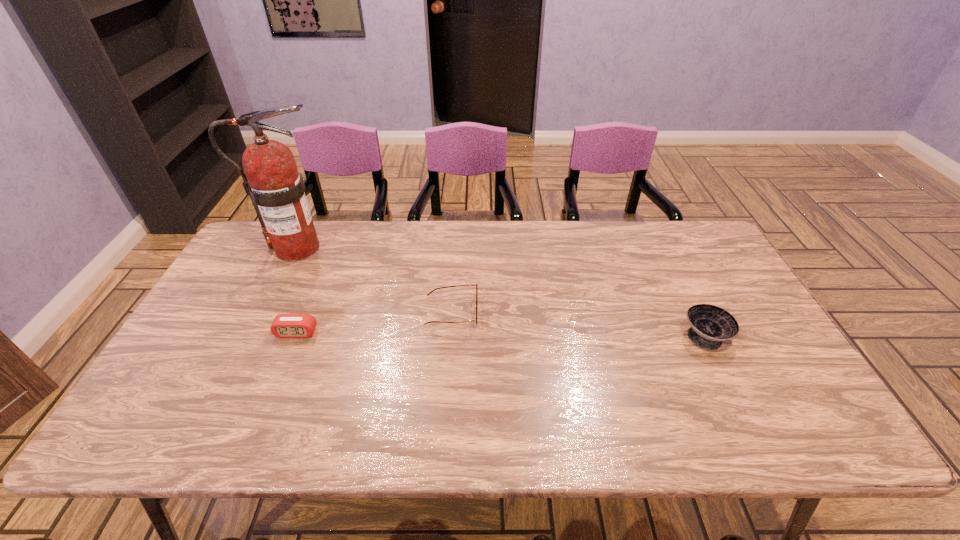
Locate an element on the screen. This screenshot has width=960, height=540. the farthest object is located at coordinates (277, 190).

This screenshot has height=540, width=960. I want to click on fire extinguisher, so click(277, 190).

Where is `the rightmost object`? the rightmost object is located at coordinates (710, 325).

Identify the location of alarm clock. (284, 325).

Where is `spectacles`? Image resolution: width=960 pixels, height=540 pixels. spectacles is located at coordinates (476, 285).

Image resolution: width=960 pixels, height=540 pixels. In order to click on blank space located at the nozzle of the tallest object in this screenshot , I will do `click(421, 248)`.

Identify the location of vacant space located 0.120m on the front of the rightmost object. (735, 396).

Where is `vacant position located on the front-facing side of the alarm clock`? The height and width of the screenshot is (540, 960). vacant position located on the front-facing side of the alarm clock is located at coordinates (266, 409).

The width and height of the screenshot is (960, 540). Find the location of `free space located on the face of the third object from left to right`. free space located on the face of the third object from left to right is located at coordinates (556, 313).

Identify the location of object at the far edge. (277, 190).